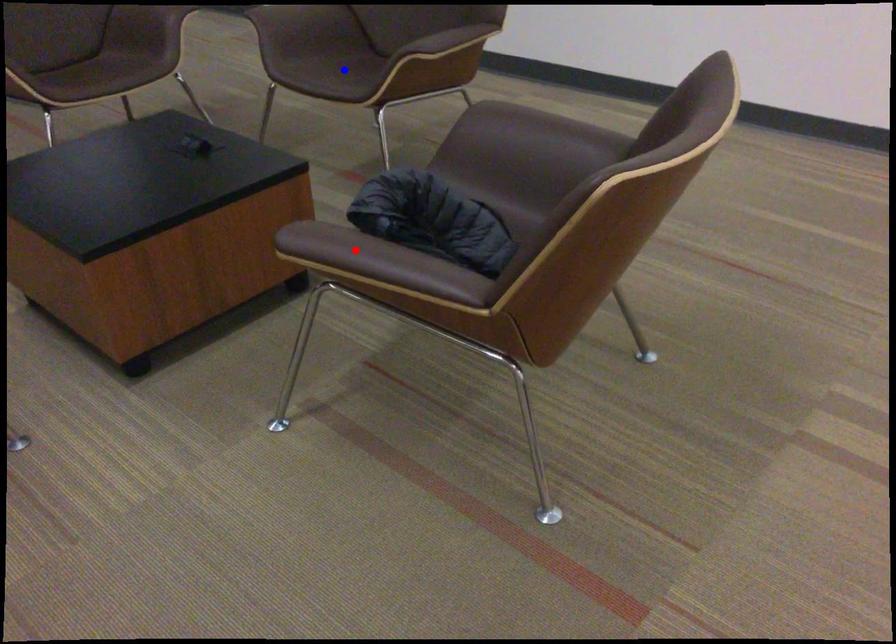
Question: In the image, two points are highlighted. Which point is nearer to the camera? Reply with the corresponding letter.

Choices:
 (A) blue point
 (B) red point

Answer: (B)